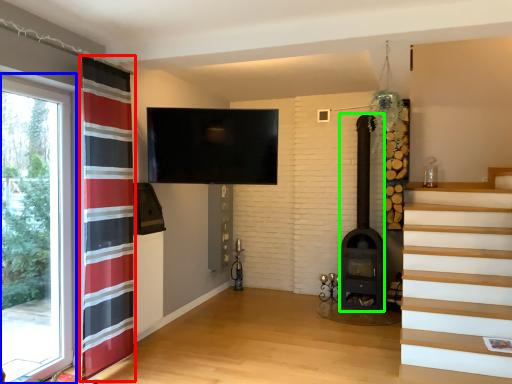
Question: Which is nearer to the curtain (highlighted by a red box)? window (highlighted by a blue box) or fireplace (highlighted by a green box).

Choices:
 (A) window
 (B) fireplace

Answer: (A)